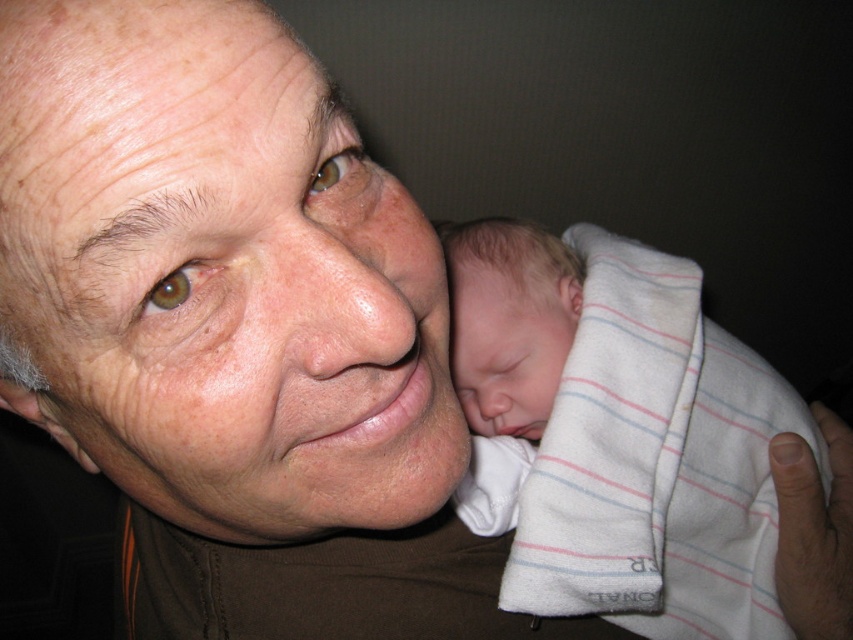
You are a photographer trying to capture a portrait of the smooth skin face at center and the soft white blanket at right. Since you want to focus on the face, which object should you make sure is smaller in your photo?

The smooth skin face at center has a smaller width than the soft white blanket at right, so you should ensure the smooth skin face at center appears smaller in the photo to focus on it.

You are a photographer taking a close up photo of an older man and a baby. You notice the smooth skin face at center and the soft white blanket at right. Which object is positioned higher in the image?

The smooth skin face at center is located above the soft white blanket at right, so it is positioned higher in the image.